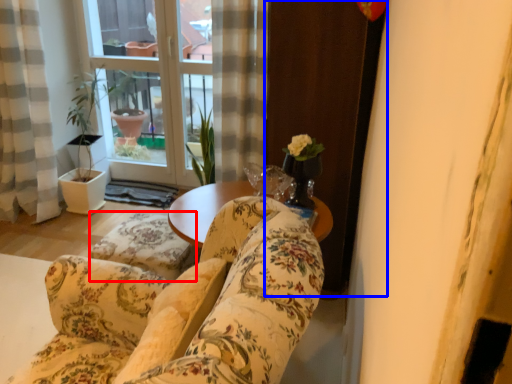
Question: Which point is closer to the camera, flat (highlighted by a red box) or screen door (highlighted by a blue box)?

Choices:
 (A) flat
 (B) screen door

Answer: (B)